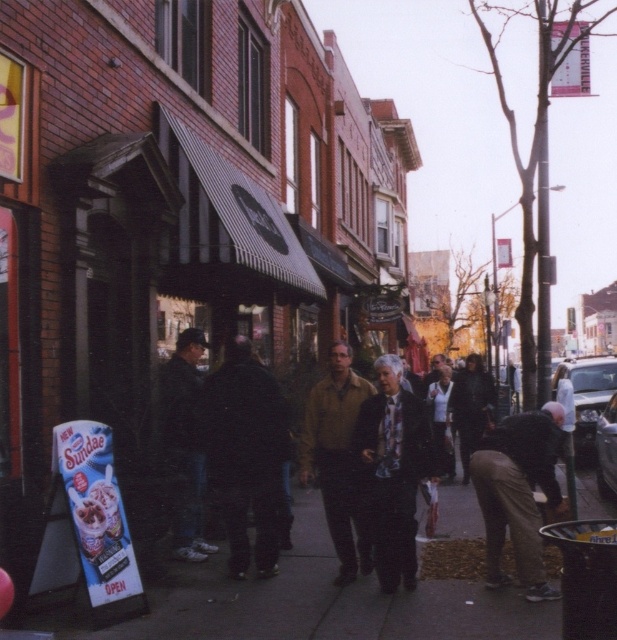
You are a customer trying to choose between two jackets displayed in the window of a store. You see the black matte jacket at center and the brown matte jacket at center. Which jacket is smaller in size?

The black matte jacket at center is smaller in size compared to the brown matte jacket at center.